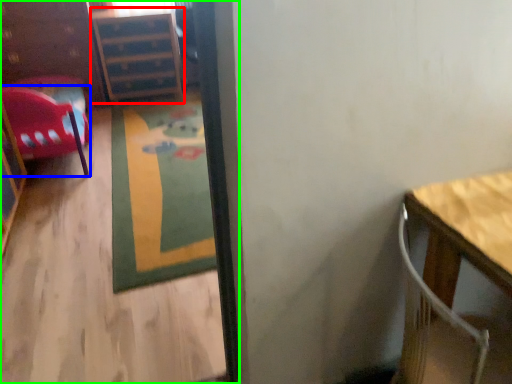
Question: Which object is positioned farthest from file cabinet (highlighted by a red box)? Select from chair (highlighted by a blue box) and corridor (highlighted by a green box).

Choices:
 (A) chair
 (B) corridor

Answer: (B)